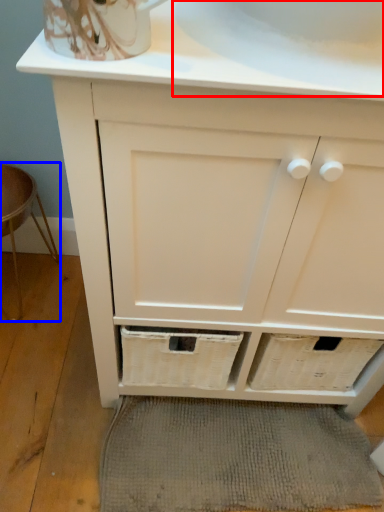
Question: Which object is closer to the camera taking this photo, sink (highlighted by a red box) or bar stool (highlighted by a blue box)?

Choices:
 (A) sink
 (B) bar stool

Answer: (A)